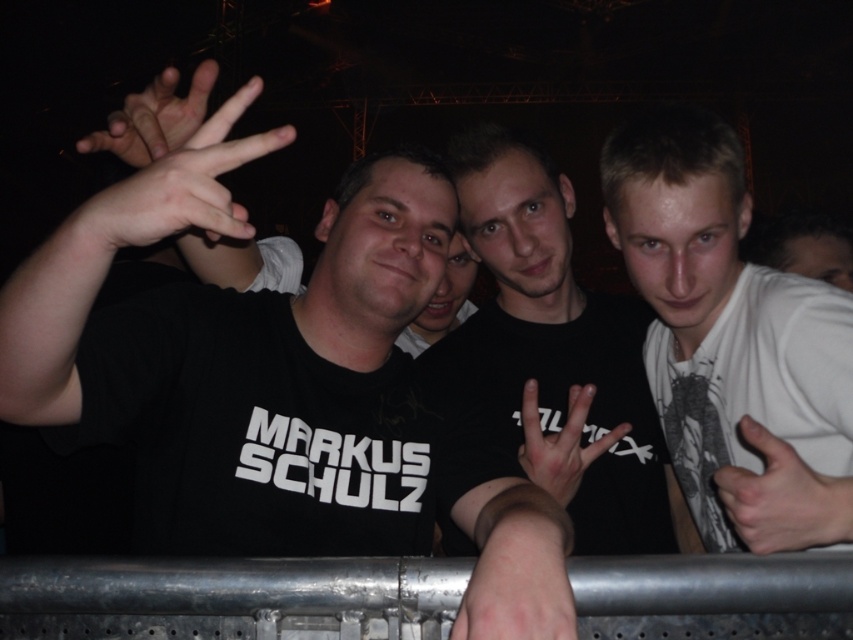
Does white matte shirt at right have a lesser width compared to matte black hand at upper left?

Indeed, white matte shirt at right has a lesser width compared to matte black hand at upper left.

Is white matte shirt at right in front of matte black hand at upper left?

No, it is behind matte black hand at upper left.

Locate an element on the screen. The width and height of the screenshot is (853, 640). white matte shirt at right is located at coordinates (730, 342).

Which is more to the right, dry skin at center or matte black hand at upper left?

Positioned to the right is dry skin at center.

Between point (555, 582) and point (154, 147), which one is positioned behind?

Positioned behind is point (154, 147).

Is point (518, 616) more distant than point (138, 138)?

No, it is not.

Identify the location of dry skin at center. (517, 579).

Between dry skin at center and matte skin hand at center, which one has less height?

dry skin at center

This screenshot has width=853, height=640. I want to click on dry skin at center, so click(x=517, y=579).